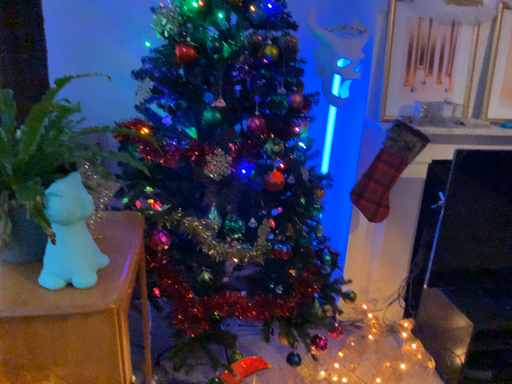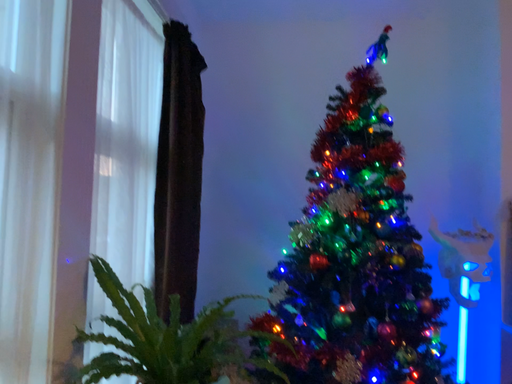
Question: Which way did the camera rotate in the video?

Choices:
 (A) rotated right
 (B) rotated left

Answer: (B)